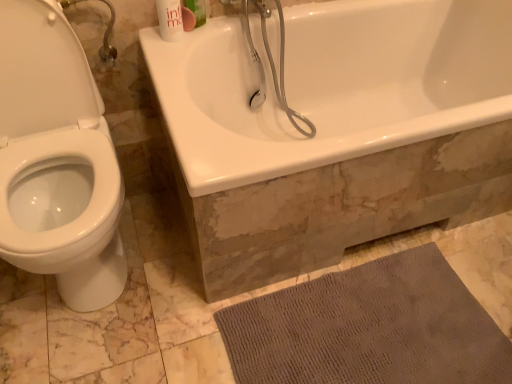
How much space does white glossy mouthwash at upper center, which is the second mouthwash in left-to-right order, occupy vertically?

It is 8.38 inches.

What do you see at coordinates (197, 10) in the screenshot?
I see `white glossy mouthwash at upper center, which is the second mouthwash in left-to-right order` at bounding box center [197, 10].

Image resolution: width=512 pixels, height=384 pixels. What are the coordinates of `gray textured bath mat at lower right` in the screenshot? It's located at [x=369, y=328].

The image size is (512, 384). In order to click on white glossy mouthwash at upper center, which is the second mouthwash in left-to-right order in this screenshot , I will do `click(197, 10)`.

Considering the relative sizes of white glossy mouthwash at upper center, which is counted as the first mouthwash, starting from the right, and white glossy bathtub at upper center in the image provided, is white glossy mouthwash at upper center, which is counted as the first mouthwash, starting from the right, bigger than white glossy bathtub at upper center?

No.

Considering the sizes of white glossy mouthwash at upper center, which is counted as the first mouthwash, starting from the right, and white glossy bathtub at upper center in the image, is white glossy mouthwash at upper center, which is counted as the first mouthwash, starting from the right, taller or shorter than white glossy bathtub at upper center?

In the image, white glossy mouthwash at upper center, which is counted as the first mouthwash, starting from the right, appears to be shorter than white glossy bathtub at upper center.

From a real-world perspective, which is physically above, white glossy mouthwash at upper center, which is counted as the first mouthwash, starting from the right, or white glossy bathtub at upper center?

white glossy mouthwash at upper center, which is counted as the first mouthwash, starting from the right.

Are white glossy bathtub at upper center and white glossy mouthwash at upper center, which is counted as the first mouthwash, starting from the right, located far from each other?

Actually, white glossy bathtub at upper center and white glossy mouthwash at upper center, which is counted as the first mouthwash, starting from the right, are a little close together.

Which object is thinner, white glossy bathtub at upper center or white glossy mouthwash at upper center, which is counted as the first mouthwash, starting from the right?

white glossy mouthwash at upper center, which is counted as the first mouthwash, starting from the right.

Could you tell me if white glossy bathtub at upper center is facing white glossy mouthwash at upper center, which is counted as the first mouthwash, starting from the right?

No.

Is white glossy bathtub at upper center taller or shorter than white glossy mouthwash at upper center, which is counted as the first mouthwash, starting from the right?

Considering their sizes, white glossy bathtub at upper center has more height than white glossy mouthwash at upper center, which is counted as the first mouthwash, starting from the right.

Are white glossy mouthwash at upper center, the first mouthwash when ordered from left to right, and gray textured bath mat at lower right located far from each other?

white glossy mouthwash at upper center, the first mouthwash when ordered from left to right, is far away from gray textured bath mat at lower right.

Is white glossy mouthwash at upper center, the first mouthwash when ordered from left to right, at the left side of gray textured bath mat at lower right?

Indeed, white glossy mouthwash at upper center, the first mouthwash when ordered from left to right, is positioned on the left side of gray textured bath mat at lower right.

Consider the image. Is white glossy mouthwash at upper center, the 2th mouthwash positioned from the right, positioned behind gray textured bath mat at lower right?

Result: Yes, it is.

From the image's perspective, would you say gray textured bath mat at lower right is shown under white glossy bathtub at upper center?

Yes.

Can you confirm if gray textured bath mat at lower right is thinner than white glossy bathtub at upper center?

Yes, gray textured bath mat at lower right is thinner than white glossy bathtub at upper center.

Could you tell me if gray textured bath mat at lower right is facing white glossy bathtub at upper center?

No.

Is gray textured bath mat at lower right at the left side of white glossy mouthwash at upper center, the first mouthwash when ordered from left to right?

Incorrect, gray textured bath mat at lower right is not on the left side of white glossy mouthwash at upper center, the first mouthwash when ordered from left to right.

Find the location of `bath mat below the white glossy mouthwash at upper center, the 2th mouthwash positioned from the right (from the image's perspective)`. bath mat below the white glossy mouthwash at upper center, the 2th mouthwash positioned from the right (from the image's perspective) is located at coordinates (369, 328).

Consider the image. Considering the relative sizes of gray textured bath mat at lower right and white glossy mouthwash at upper center, which is the second mouthwash in left-to-right order, in the image provided, is gray textured bath mat at lower right bigger than white glossy mouthwash at upper center, which is the second mouthwash in left-to-right order,?

Indeed, gray textured bath mat at lower right has a larger size compared to white glossy mouthwash at upper center, which is the second mouthwash in left-to-right order.

Is the position of gray textured bath mat at lower right more distant than that of white glossy mouthwash at upper center, which is the second mouthwash in left-to-right order?

No, gray textured bath mat at lower right is in front of white glossy mouthwash at upper center, which is the second mouthwash in left-to-right order.

Is gray textured bath mat at lower right positioned with its back to white glossy mouthwash at upper center, which is the second mouthwash in left-to-right order?

No.

Locate an element on the screen. This screenshot has height=384, width=512. bath mat on the right of white glossy mouthwash at upper center, which is the second mouthwash in left-to-right order is located at coordinates (369, 328).

From the image's perspective, is white glossy bathtub at upper center above or below gray textured bath mat at lower right?

white glossy bathtub at upper center is situated higher than gray textured bath mat at lower right in the image.

Which is behind, point (377, 141) or point (373, 335)?

The point (373, 335) is behind.

Which of these two, white glossy bathtub at upper center or gray textured bath mat at lower right, stands taller?

white glossy bathtub at upper center is taller.

Considering the relative sizes of white glossy bathtub at upper center and gray textured bath mat at lower right in the image provided, is white glossy bathtub at upper center thinner than gray textured bath mat at lower right?

No, white glossy bathtub at upper center is not thinner than gray textured bath mat at lower right.

Identify the location of bathtub that is on the right side of white glossy mouthwash at upper center, which is counted as the first mouthwash, starting from the right. (331, 85).

Locate an element on the screen. The height and width of the screenshot is (384, 512). bathtub below the white glossy mouthwash at upper center, which is the second mouthwash in left-to-right order (from the image's perspective) is located at coordinates (331, 85).

Which object lies further to the anchor point white glossy mouthwash at upper center, the 2th mouthwash positioned from the right, gray textured bath mat at lower right or white glossy bathtub at upper center?

gray textured bath mat at lower right is further to white glossy mouthwash at upper center, the 2th mouthwash positioned from the right.

Based on their spatial positions, is white glossy mouthwash at upper center, which is counted as the first mouthwash, starting from the right, or gray textured bath mat at lower right closer to white glossy mouthwash at upper center, the 2th mouthwash positioned from the right?

white glossy mouthwash at upper center, which is counted as the first mouthwash, starting from the right.

Considering their positions, is white glossy bathtub at upper center positioned further to white glossy mouthwash at upper center, which is the second mouthwash in left-to-right order, than white glossy mouthwash at upper center, the 2th mouthwash positioned from the right?

Based on the image, white glossy bathtub at upper center appears to be further to white glossy mouthwash at upper center, which is the second mouthwash in left-to-right order.

Based on their spatial positions, is white glossy bathtub at upper center or white glossy mouthwash at upper center, the 2th mouthwash positioned from the right, closer to gray textured bath mat at lower right?

Based on the image, white glossy bathtub at upper center appears to be nearer to gray textured bath mat at lower right.

Considering their positions, is white glossy mouthwash at upper center, the first mouthwash when ordered from left to right, positioned further to white glossy mouthwash at upper center, which is counted as the first mouthwash, starting from the right, than white glossy bathtub at upper center?

white glossy bathtub at upper center lies further to white glossy mouthwash at upper center, which is counted as the first mouthwash, starting from the right, than the other object.

From the image, which object appears to be nearer to gray textured bath mat at lower right, white glossy bathtub at upper center or white glossy mouthwash at upper center, which is counted as the first mouthwash, starting from the right?

Among the two, white glossy bathtub at upper center is located nearer to gray textured bath mat at lower right.

Which object lies further to the anchor point white glossy mouthwash at upper center, the first mouthwash when ordered from left to right, white glossy bathtub at upper center or gray textured bath mat at lower right?

The object further to white glossy mouthwash at upper center, the first mouthwash when ordered from left to right, is gray textured bath mat at lower right.

When comparing their distances from white glossy mouthwash at upper center, the first mouthwash when ordered from left to right, does white glossy bathtub at upper center or white glossy mouthwash at upper center, which is the second mouthwash in left-to-right order, seem closer?

The object closer to white glossy mouthwash at upper center, the first mouthwash when ordered from left to right, is white glossy mouthwash at upper center, which is the second mouthwash in left-to-right order.

The width and height of the screenshot is (512, 384). Find the location of `mouthwash between white glossy mouthwash at upper center, which is counted as the first mouthwash, starting from the right, and gray textured bath mat at lower right from top to bottom`. mouthwash between white glossy mouthwash at upper center, which is counted as the first mouthwash, starting from the right, and gray textured bath mat at lower right from top to bottom is located at coordinates click(x=170, y=20).

The height and width of the screenshot is (384, 512). Find the location of `bathtub between white glossy mouthwash at upper center, the first mouthwash when ordered from left to right, and gray textured bath mat at lower right, in the vertical direction`. bathtub between white glossy mouthwash at upper center, the first mouthwash when ordered from left to right, and gray textured bath mat at lower right, in the vertical direction is located at coordinates (331, 85).

Image resolution: width=512 pixels, height=384 pixels. I want to click on bathtub between white glossy mouthwash at upper center, which is the second mouthwash in left-to-right order, and gray textured bath mat at lower right vertically, so click(331, 85).

I want to click on mouthwash located between white glossy mouthwash at upper center, the 2th mouthwash positioned from the right, and white glossy bathtub at upper center in the left-right direction, so click(197, 10).